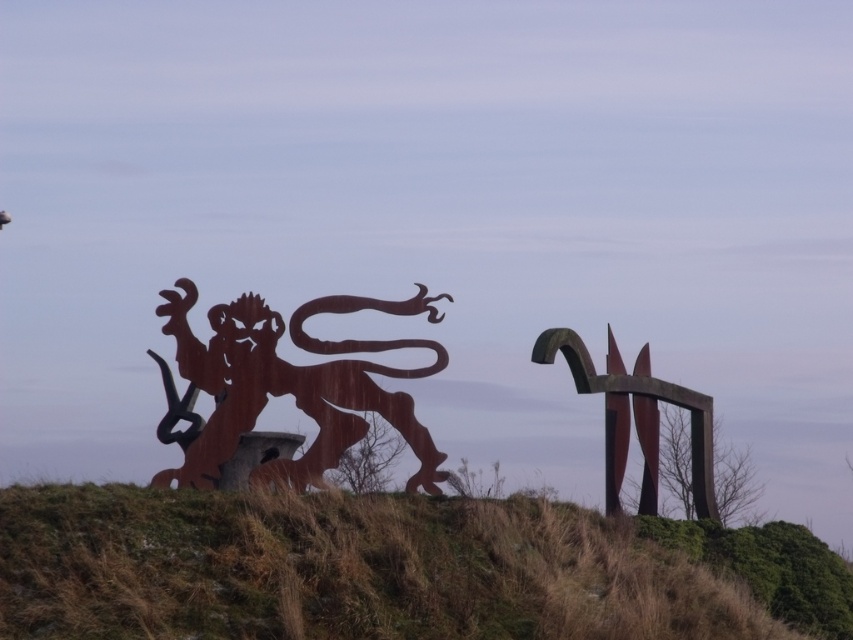
Is point (468, 616) in front of point (566, 333)?

Yes, it is.

Which is above, brown grassy hillside at lower center or rusty metal sculpture at right?

Positioned higher is rusty metal sculpture at right.

Is point (351, 628) positioned before point (695, 481)?

Yes, it is.

What are the coordinates of `brown grassy hillside at lower center` in the screenshot? It's located at (345, 570).

Can you confirm if brown grassy hillside at lower center is taller than rusty metal lion at left?

No.

Is brown grassy hillside at lower center thinner than rusty metal lion at left?

Incorrect, brown grassy hillside at lower center's width is not less than rusty metal lion at left's.

Which is behind, point (552, 520) or point (315, 304)?

The point (315, 304) is more distant.

Where is `brown grassy hillside at lower center`? brown grassy hillside at lower center is located at coordinates (345, 570).

From the picture: Can you confirm if rusty metal lion at left is positioned below rusty metal sculpture at right?

Incorrect, rusty metal lion at left is not positioned below rusty metal sculpture at right.

Is rusty metal lion at left behind rusty metal sculpture at right?

No, it is in front of rusty metal sculpture at right.

Is point (207, 365) closer to camera compared to point (610, 356)?

Yes, point (207, 365) is closer to viewer.

Locate an element on the screen. rusty metal lion at left is located at coordinates (287, 385).